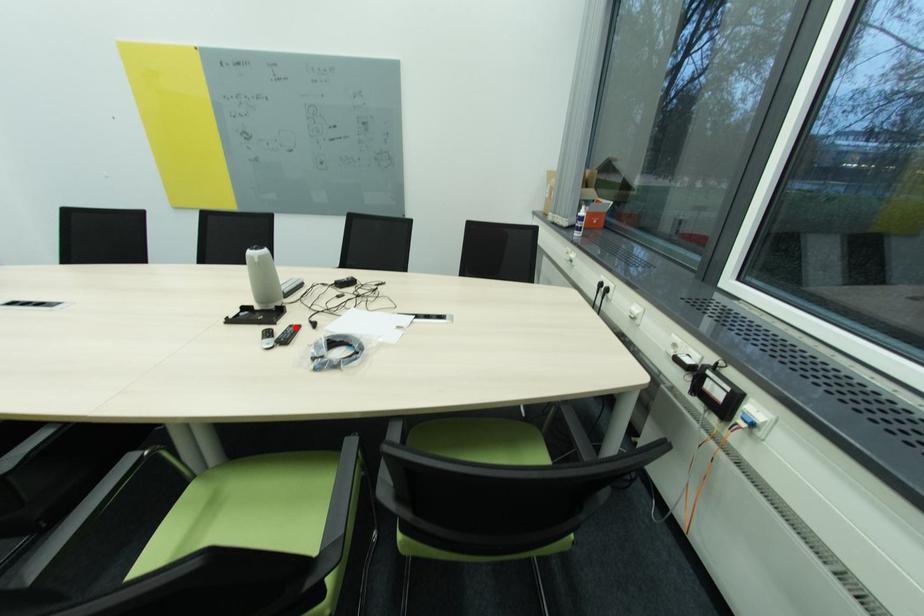
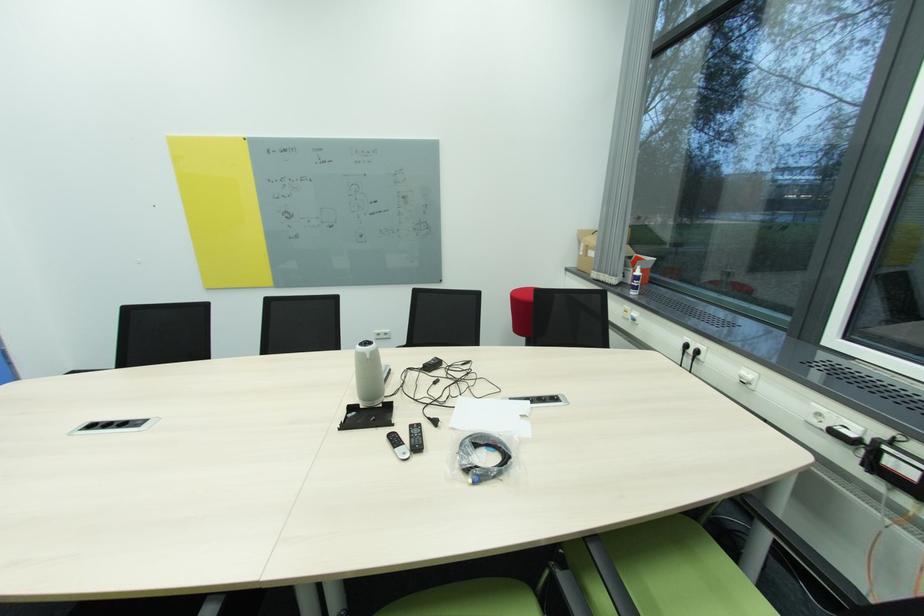
Locate, in the second image, the point that corresponds to the highlighted location in the first image.

(416, 427)